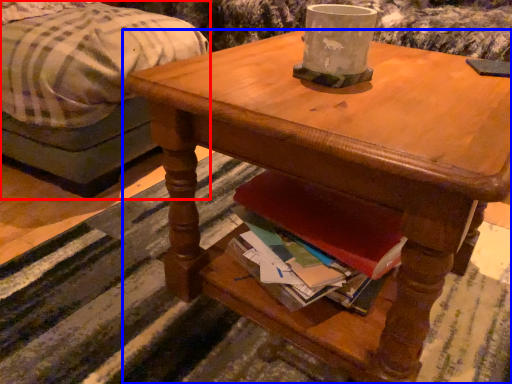
Question: Among these objects, which one is nearest to the camera, studio couch (highlighted by a red box) or desk (highlighted by a blue box)?

Choices:
 (A) studio couch
 (B) desk

Answer: (B)